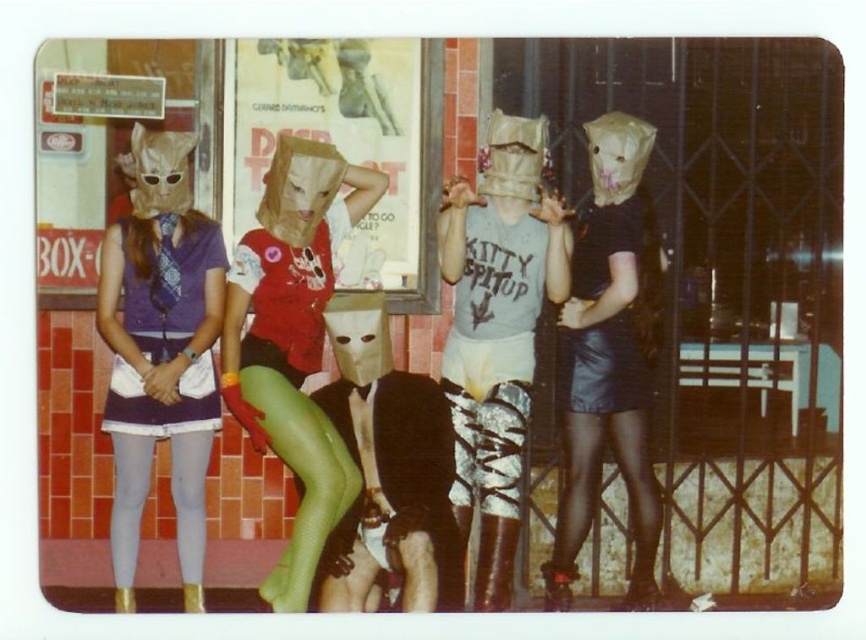
Between matte purple dress at left and light gray tights at lower left, which one appears on the right side from the viewer's perspective?

matte purple dress at left is more to the right.

Who is taller, matte purple dress at left or light gray tights at lower left?

matte purple dress at left is taller.

Identify the location of matte purple dress at left. This screenshot has height=640, width=866. (160, 353).

Find the location of a particular element. Image resolution: width=866 pixels, height=640 pixels. matte purple dress at left is located at coordinates (160, 353).

Can you confirm if matte gray tank top at center is wider than black leather skirt at right?

Indeed, matte gray tank top at center has a greater width compared to black leather skirt at right.

Does matte gray tank top at center have a lesser height compared to black leather skirt at right?

In fact, matte gray tank top at center may be taller than black leather skirt at right.

Find the location of a particular element. matte gray tank top at center is located at coordinates pyautogui.click(x=496, y=330).

Does shiny black skirt at right appear under black leather stockings at lower right?

No.

Describe the element at coordinates (606, 362) in the screenshot. This screenshot has width=866, height=640. I see `shiny black skirt at right` at that location.

Image resolution: width=866 pixels, height=640 pixels. I want to click on shiny black skirt at right, so click(606, 362).